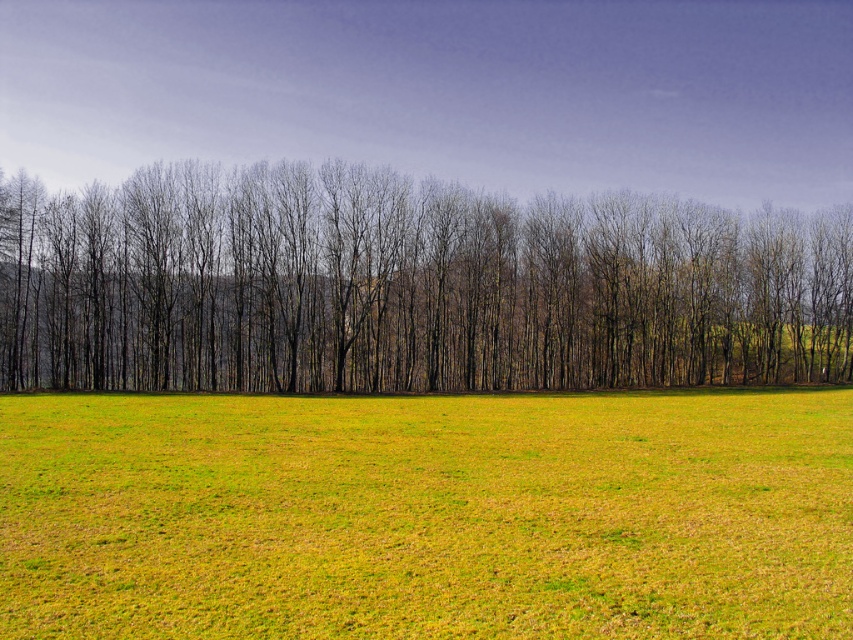
Can you confirm if green grass at center is smaller than brown/dry wood trees at center?

Correct, green grass at center occupies less space than brown/dry wood trees at center.

You are a GUI agent. You are given a task and a screenshot of the screen. Output one action in this format:
    pyautogui.click(x=<x>, y=<y>)
    Task: Click on the green grass at center
    This screenshot has height=640, width=853.
    Given the screenshot: What is the action you would take?
    pyautogui.click(x=427, y=515)

Identify the location of green grass at center. The width and height of the screenshot is (853, 640). (427, 515).